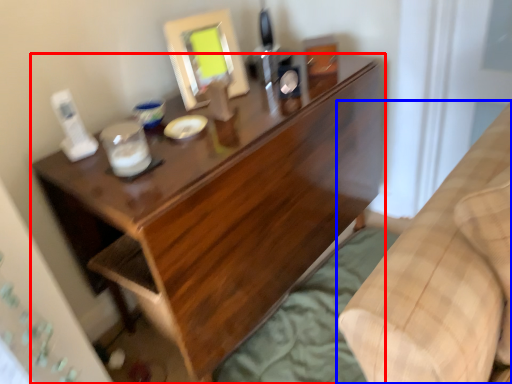
Question: Which of the following is the farthest to the observer, desk (highlighted by a red box) or furniture (highlighted by a blue box)?

Choices:
 (A) desk
 (B) furniture

Answer: (A)